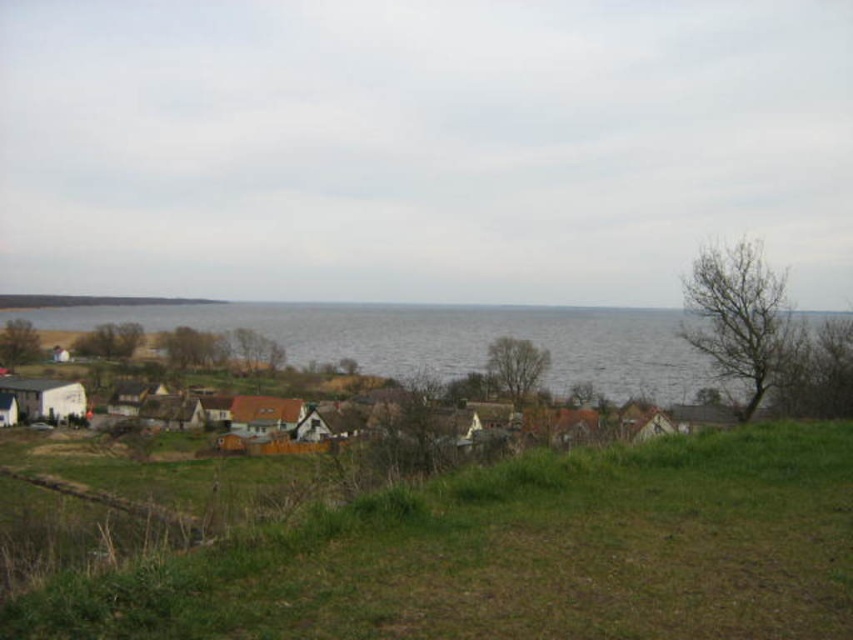
Question: Can you confirm if green grassy field at lower center is bigger than white wooden houses at lower left?

Choices:
 (A) no
 (B) yes

Answer: (A)

Question: Can you confirm if green grassy field at lower center is positioned below white wooden houses at lower left?

Choices:
 (A) yes
 (B) no

Answer: (B)

Question: Which object appears closest to the camera in this image?

Choices:
 (A) green grassy field at lower center
 (B) white wooden houses at lower left
 (C) gray water at center

Answer: (A)

Question: Which of these objects is positioned closest to the gray water at center?

Choices:
 (A) green grassy field at lower center
 (B) white wooden houses at lower left

Answer: (B)

Question: Does gray water at center have a smaller size compared to white wooden houses at lower left?

Choices:
 (A) no
 (B) yes

Answer: (A)

Question: Which object appears farthest from the camera in this image?

Choices:
 (A) green grassy field at lower center
 (B) gray water at center

Answer: (B)